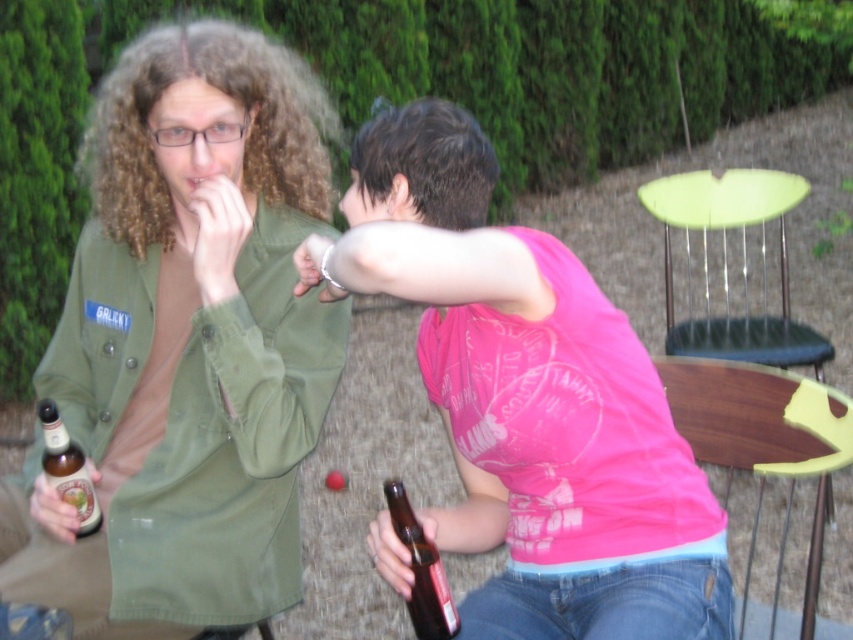
Question: Among these objects, which one is farthest from the camera?

Choices:
 (A) pink cotton shirt at center
 (B) brown glass bottle at lower center
 (C) pink fabric tank top at upper right

Answer: (C)

Question: Which of these objects is positioned closest to the brown glass bottle at lower center?

Choices:
 (A) pink fabric tank top at upper right
 (B) yellow plastic chair at lower right
 (C) pink cotton shirt at center

Answer: (C)

Question: Does yellow plastic chair at lower right appear on the left side of brown glass bottle at lower left?

Choices:
 (A) yes
 (B) no

Answer: (B)

Question: Does pink fabric tank top at upper right appear on the left side of yellow plastic chair at lower right?

Choices:
 (A) yes
 (B) no

Answer: (A)

Question: Which object is farther from the camera taking this photo?

Choices:
 (A) brown glass bottle at lower center
 (B) brown glass bottle at lower left
 (C) yellow plastic chair at lower right

Answer: (B)

Question: Can you confirm if pink cotton shirt at center is wider than yellow plastic chair at lower right?

Choices:
 (A) no
 (B) yes

Answer: (B)